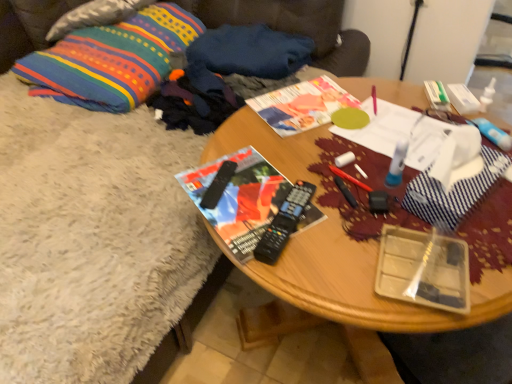
I want to click on free space to the right of black plastic remote control at center, the 1th remote control in the right-to-left sequence, so click(349, 225).